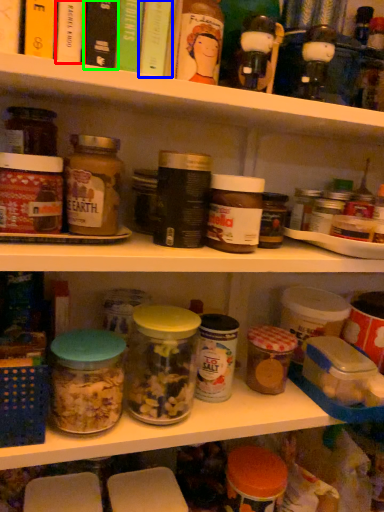
Question: Considering the real-world distances, which object is farthest from book (highlighted by a red box)? book (highlighted by a blue box) or book (highlighted by a green box)?

Choices:
 (A) book
 (B) book

Answer: (A)